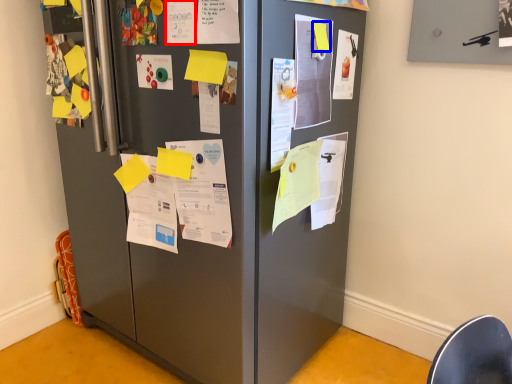
Question: Which of the following is the closest to the observer, poster (highlighted by a red box) or note (highlighted by a blue box)?

Choices:
 (A) poster
 (B) note

Answer: (A)